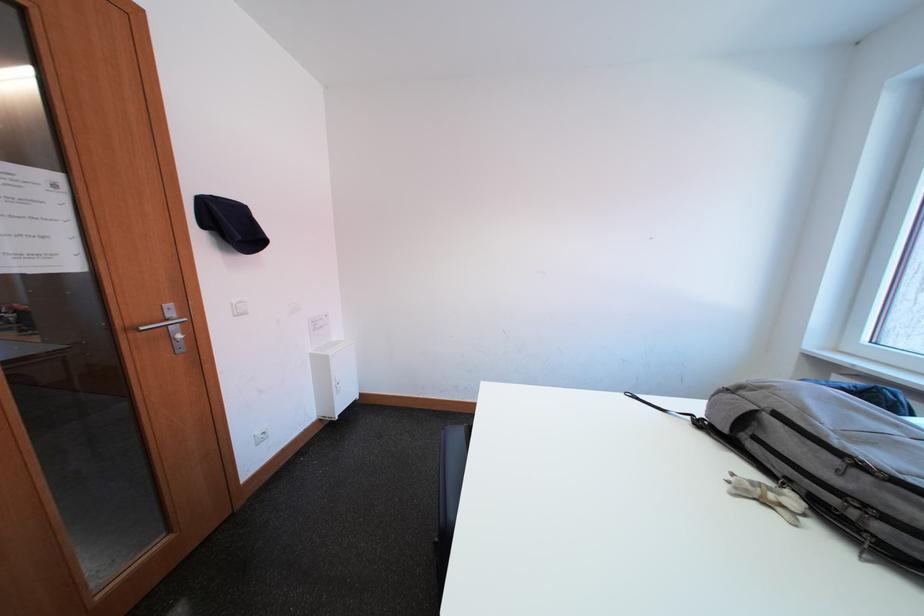
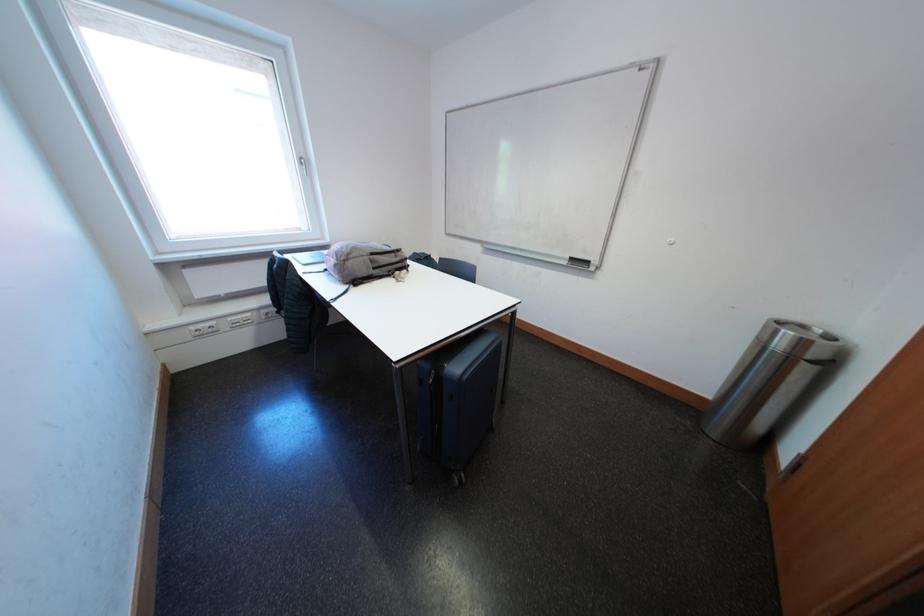
The point at (849, 476) is marked in the first image. Where is the corresponding point in the second image?

(406, 261)